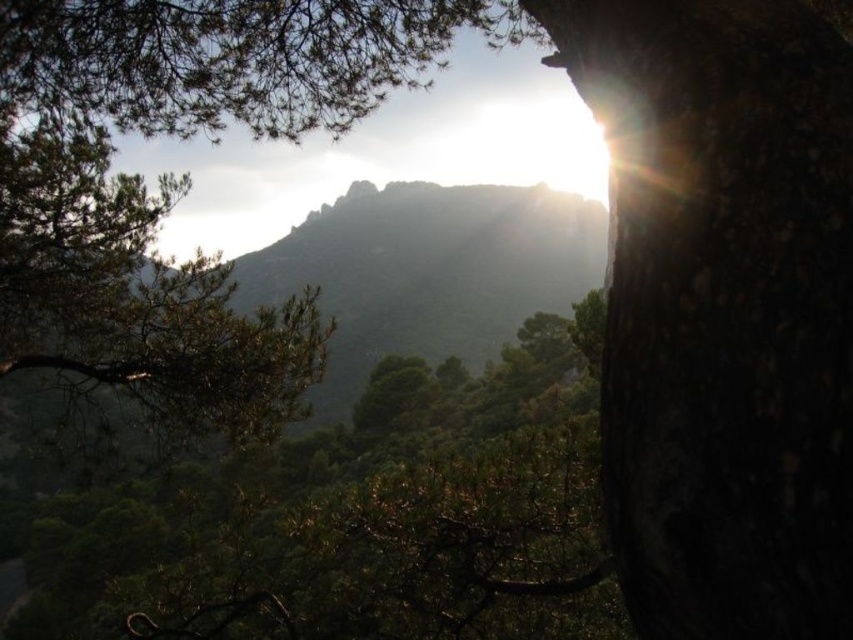
You are standing in the foreground of the serene landscape scene. You want to walk towards the dark bark tree trunk at right. Which direction should you move relative to your current position?

The dark bark tree trunk at right is located at point 0.484 on the x and 0.850 on the y coordinates, so you should move towards the right and slightly forward to reach it.